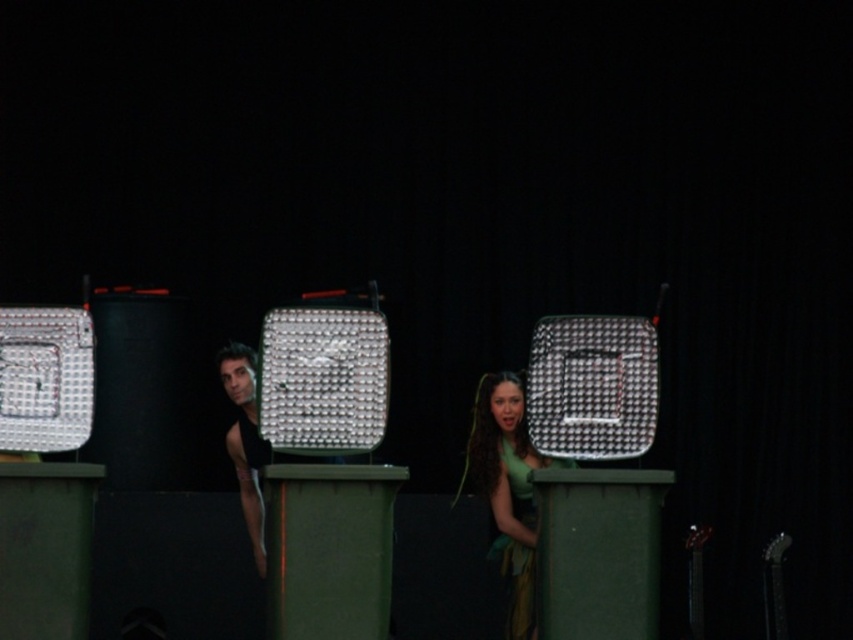
Question: Which point appears farthest from the camera in this image?

Choices:
 (A) 242,346
 (B) 525,552

Answer: (A)

Question: Can you confirm if green matte dress at center is bigger than black matte tank top at center?

Choices:
 (A) no
 (B) yes

Answer: (B)

Question: Among these points, which one is farthest from the camera?

Choices:
 (A) (531, 540)
 (B) (253, 400)

Answer: (B)

Question: Does green matte dress at center appear on the right side of black matte tank top at center?

Choices:
 (A) no
 (B) yes

Answer: (B)

Question: Can you confirm if green matte dress at center is thinner than black matte tank top at center?

Choices:
 (A) no
 (B) yes

Answer: (A)

Question: Which point is closer to the camera taking this photo?

Choices:
 (A) click(x=262, y=548)
 (B) click(x=524, y=435)

Answer: (B)